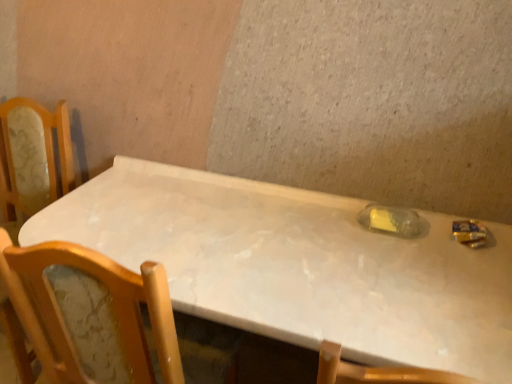
Question: Based on their sizes in the image, would you say white marble table at center is bigger or smaller than translucent plastic bottle at center?

Choices:
 (A) small
 (B) big

Answer: (B)

Question: From their relative heights in the image, would you say white marble table at center is taller or shorter than translucent plastic bottle at center?

Choices:
 (A) tall
 (B) short

Answer: (A)

Question: From the image's perspective, is white marble table at center above or below translucent plastic bottle at center?

Choices:
 (A) above
 (B) below

Answer: (B)

Question: Is point (395, 220) positioned closer to the camera than point (337, 286)?

Choices:
 (A) closer
 (B) farther

Answer: (B)

Question: From a real-world perspective, is translucent plastic bottle at center physically located above or below white marble table at center?

Choices:
 (A) above
 (B) below

Answer: (A)

Question: Considering the positions of translucent plastic bottle at center and white marble table at center in the image, is translucent plastic bottle at center bigger or smaller than white marble table at center?

Choices:
 (A) small
 (B) big

Answer: (A)

Question: From the image's perspective, is translucent plastic bottle at center positioned above or below white marble table at center?

Choices:
 (A) below
 (B) above

Answer: (B)